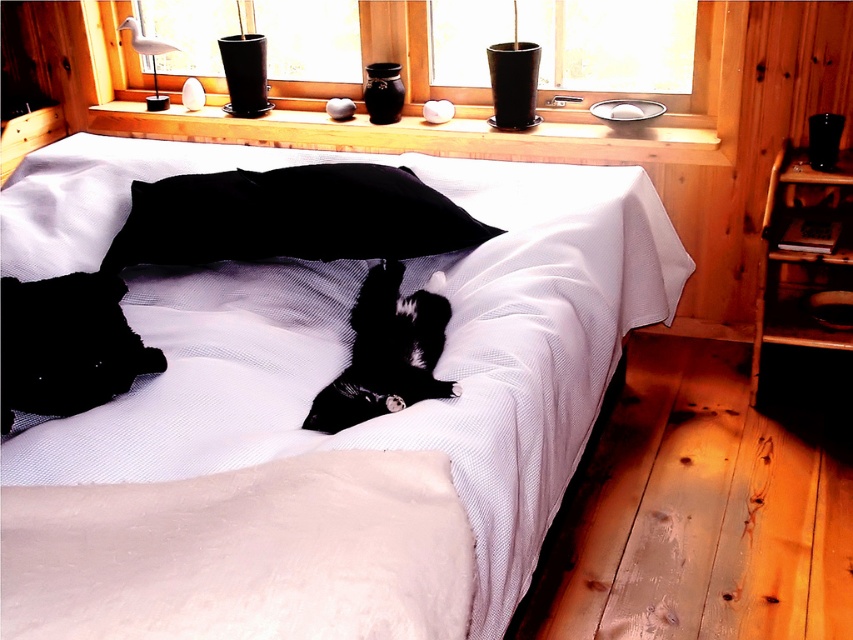
Question: Which object is closer to the camera taking this photo?

Choices:
 (A) black matte pillow at center
 (B) smooth glass window at center

Answer: (A)

Question: Is black matte pillow at center to the left of smooth glass window at center from the viewer's perspective?

Choices:
 (A) no
 (B) yes

Answer: (B)

Question: Is the position of black matte pillow at center less distant than that of smooth glass window at center?

Choices:
 (A) yes
 (B) no

Answer: (A)

Question: Is white textured bed at center below smooth glass window at center?

Choices:
 (A) yes
 (B) no

Answer: (A)

Question: Which object is positioned farthest from the black matte pillow at center?

Choices:
 (A) white textured bed at center
 (B) smooth glass window at center

Answer: (B)

Question: Considering the real-world distances, which object is farthest from the white textured bed at center?

Choices:
 (A) black matte pillow at center
 (B) smooth glass window at center

Answer: (B)